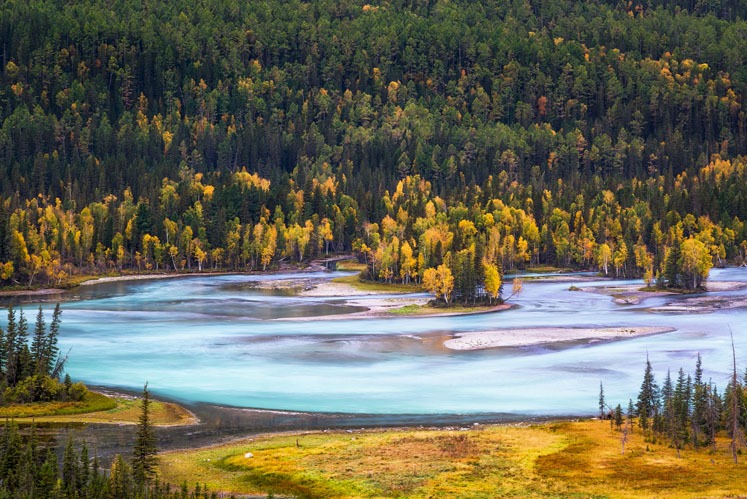
Locate an element on the screen. The image size is (747, 499). corner is located at coordinates (725, 480), (19, 479), (19, 46), (722, 21).